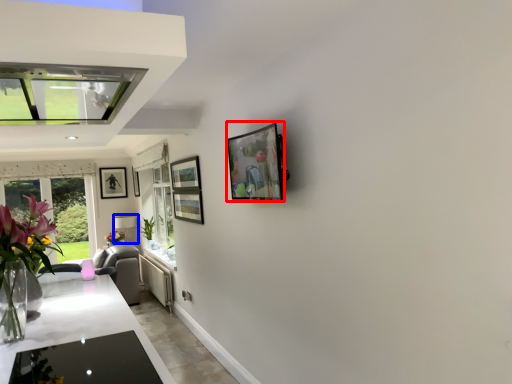
Question: Which point is further to the camera, picture frame (highlighted by a red box) or lamp (highlighted by a blue box)?

Choices:
 (A) picture frame
 (B) lamp

Answer: (B)